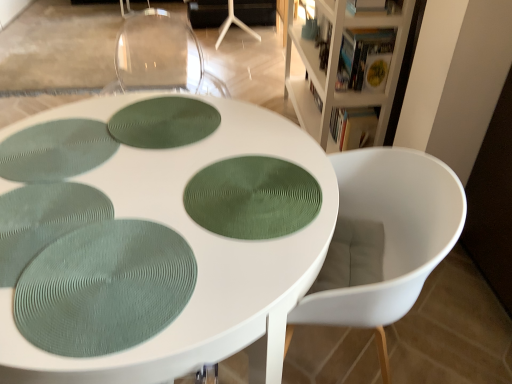
Image resolution: width=512 pixels, height=384 pixels. What are the coordinates of `free spot to the right of green textured placemat at lower left, which is the first oval from front to back` in the screenshot? It's located at (249, 256).